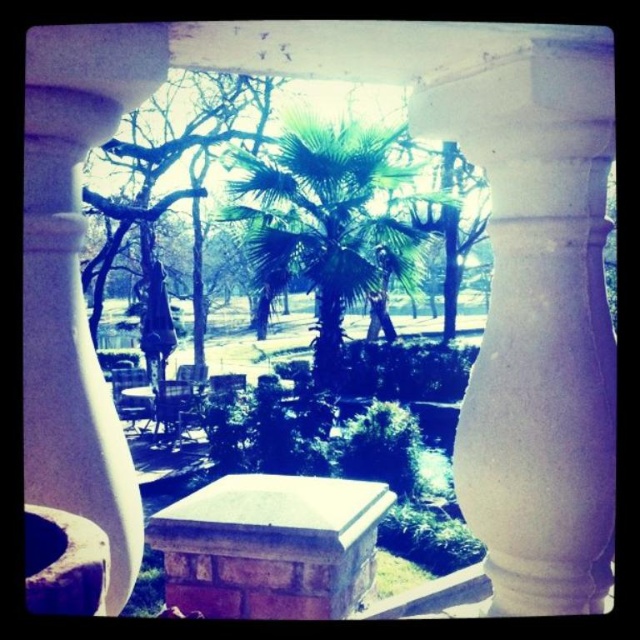
Question: Does green leafy palm tree at center have a lesser width compared to green leafy tree at center?

Choices:
 (A) no
 (B) yes

Answer: (A)

Question: Can you confirm if white stone pillar at center is wider than green leafy palm tree at center?

Choices:
 (A) no
 (B) yes

Answer: (A)

Question: Which object is the closest to the white smooth pillar at center?

Choices:
 (A) green leafy palm tree at center
 (B) green leafy tree at center

Answer: (A)

Question: Which point is closer to the camera taking this photo?

Choices:
 (A) (106, 40)
 (B) (596, 227)
 (C) (266, 205)
 (D) (92, 317)

Answer: (A)

Question: In this image, where is white stone pillar at center located relative to green leafy palm tree at center?

Choices:
 (A) right
 (B) left

Answer: (B)

Question: Estimate the real-world distances between objects in this image. Which object is closer to the white smooth pillar at center?

Choices:
 (A) green leafy tree at center
 (B) white stone pillar at center
 (C) green leafy palm tree at center

Answer: (B)